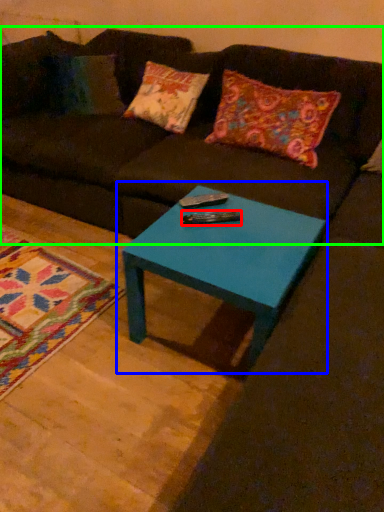
Question: Which object is the closest to the remote (highlighted by a red box)? Choose among these: coffee table (highlighted by a blue box) or studio couch (highlighted by a green box).

Choices:
 (A) coffee table
 (B) studio couch

Answer: (A)